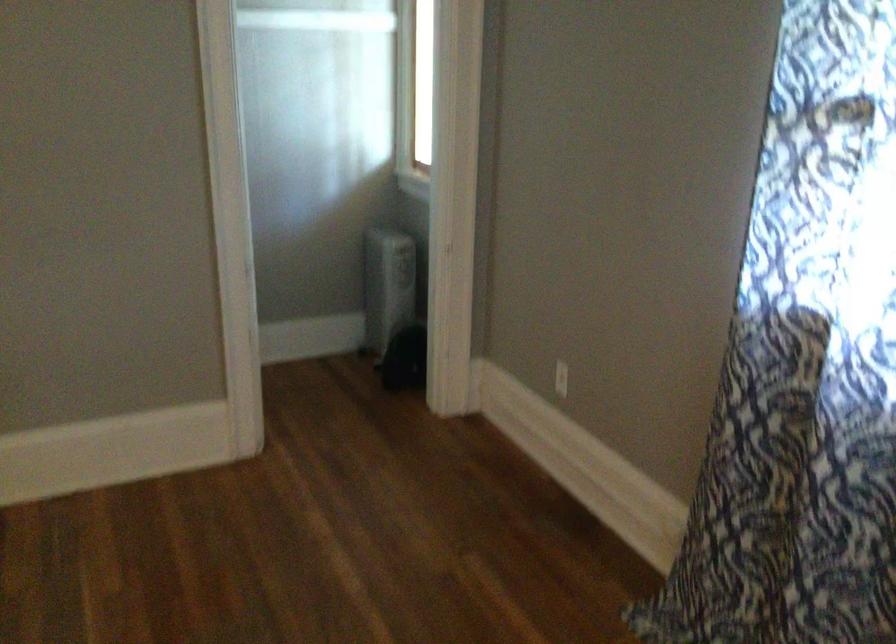
What are the coordinates of `white closet rod` in the screenshot? It's located at (313, 13).